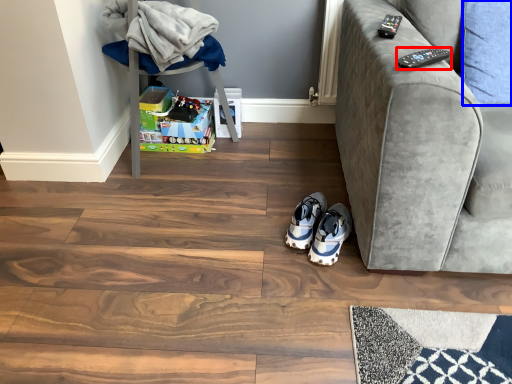
Question: Which object appears farthest to the camera in this image, remote (highlighted by a red box) or pillow (highlighted by a blue box)?

Choices:
 (A) remote
 (B) pillow

Answer: (B)